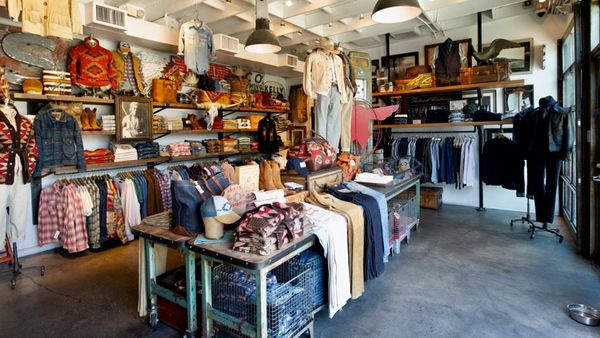
You are a GUI agent. You are given a task and a screenshot of the screen. Output one action in this format:
    pyautogui.click(x=<x>, y=<y>)
    Task: Click on the mannequin
    
    Given the screenshot: What is the action you would take?
    pyautogui.click(x=351, y=92)